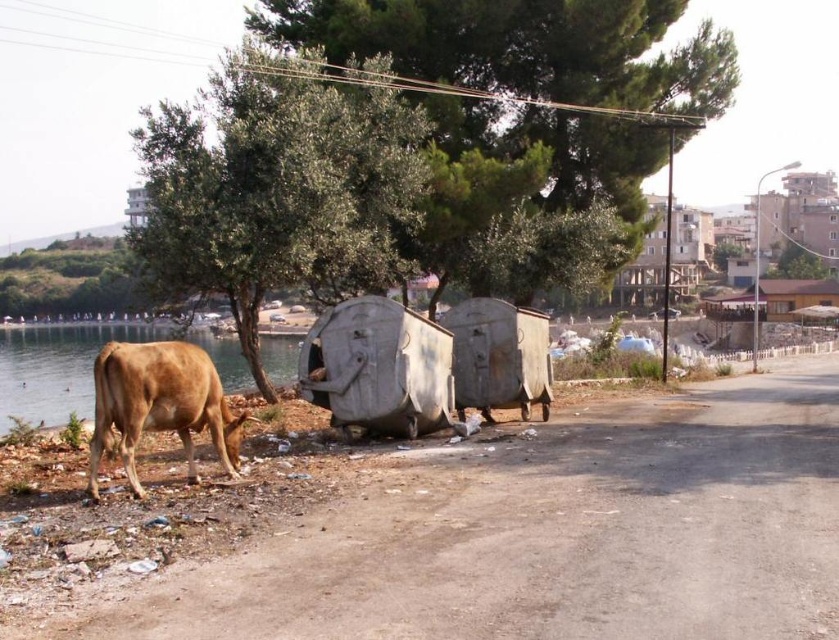
You are a photographer trying to capture the entire brown matte cow at lower left and the green leafy tree at upper left in a single frame. Based on their widths, which object should you focus on to ensure both fit in the photo?

Since the green leafy tree at upper left is narrower than the brown matte cow at lower left, you should focus on framing the brown matte cow at lower left first to ensure both fit in the photo.

You are standing in the waterfront area and see the green leafy tree at upper left and the green leafy tree at upper center. Which tree is located more to the left?

The green leafy tree at upper left is more to the left than the green leafy tree at upper center.